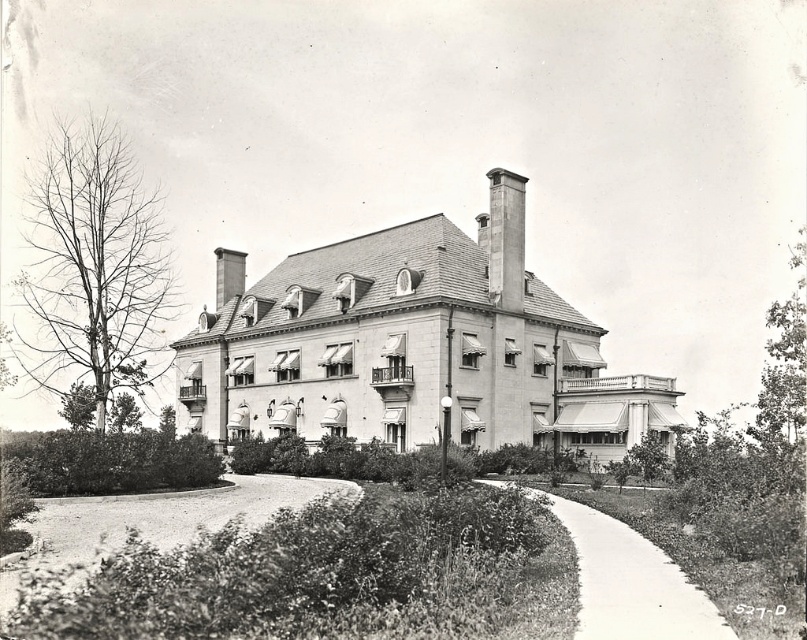
Question: Can you confirm if smooth concrete path at lower center is positioned to the right of smooth stone chimney at upper center?

Choices:
 (A) no
 (B) yes

Answer: (B)

Question: Does smooth concrete path at lower center appear on the left side of smooth stone chimney at upper center?

Choices:
 (A) yes
 (B) no

Answer: (B)

Question: Which object is farther from the camera taking this photo?

Choices:
 (A) smooth concrete path at lower center
 (B) smooth stone chimney at upper center

Answer: (B)

Question: Which point is farther to the camera?

Choices:
 (A) (633, 572)
 (B) (502, 172)

Answer: (B)

Question: Does smooth concrete path at lower center have a greater width compared to smooth stone chimney at upper center?

Choices:
 (A) no
 (B) yes

Answer: (B)